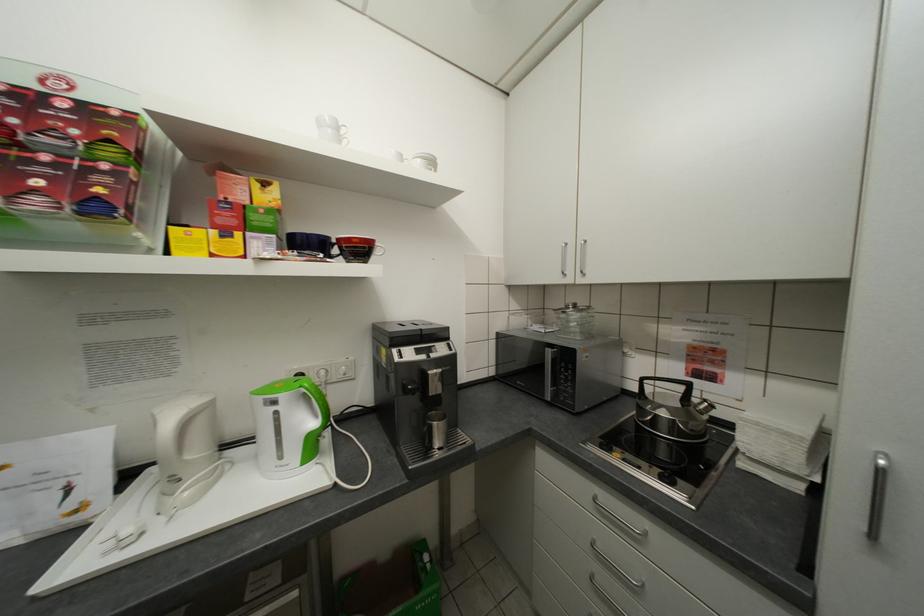
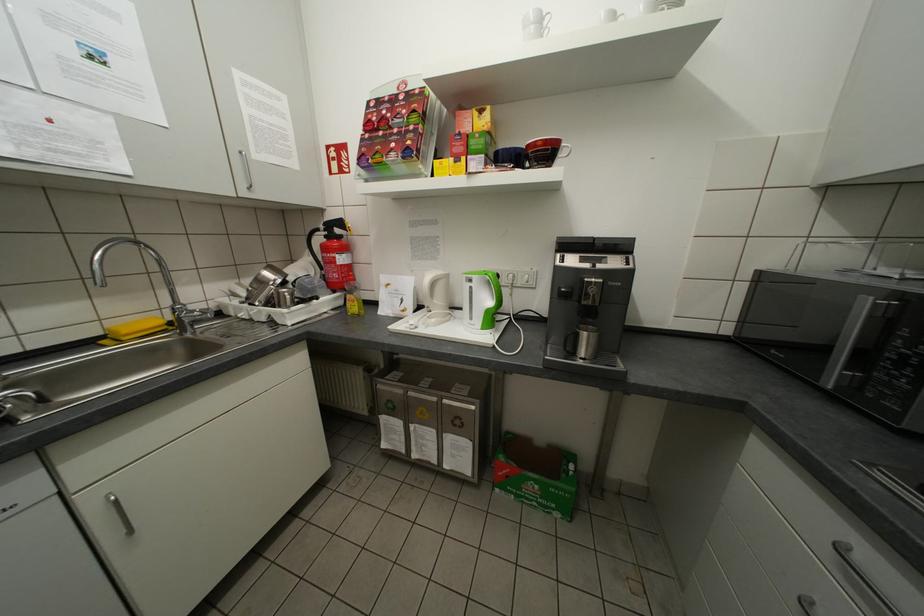
Where in the second image is the point corresponding to (447,448) from the first image?

(590, 359)